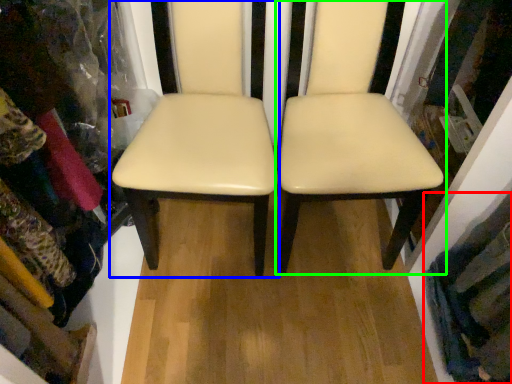
Question: Based on their relative distances, which object is farther from clothing (highlighted by a red box)? Choose from chair (highlighted by a blue box) and chair (highlighted by a green box).

Choices:
 (A) chair
 (B) chair

Answer: (A)